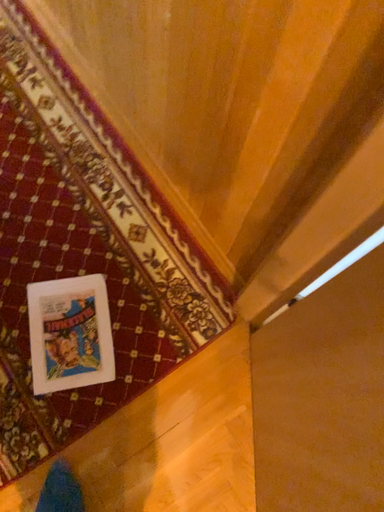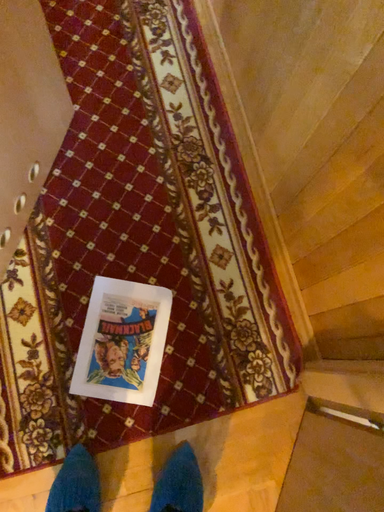
Question: Which way did the camera rotate in the video?

Choices:
 (A) rotated left
 (B) rotated right

Answer: (A)